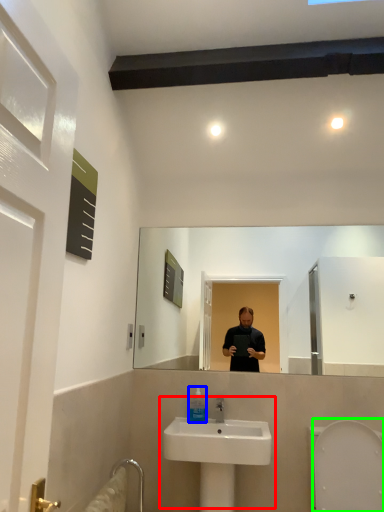
Question: Based on their relative distances, which object is nearer to sink (highlighted by a red box)? Choose from mouthwash (highlighted by a blue box) and bidet (highlighted by a green box).

Choices:
 (A) mouthwash
 (B) bidet

Answer: (A)